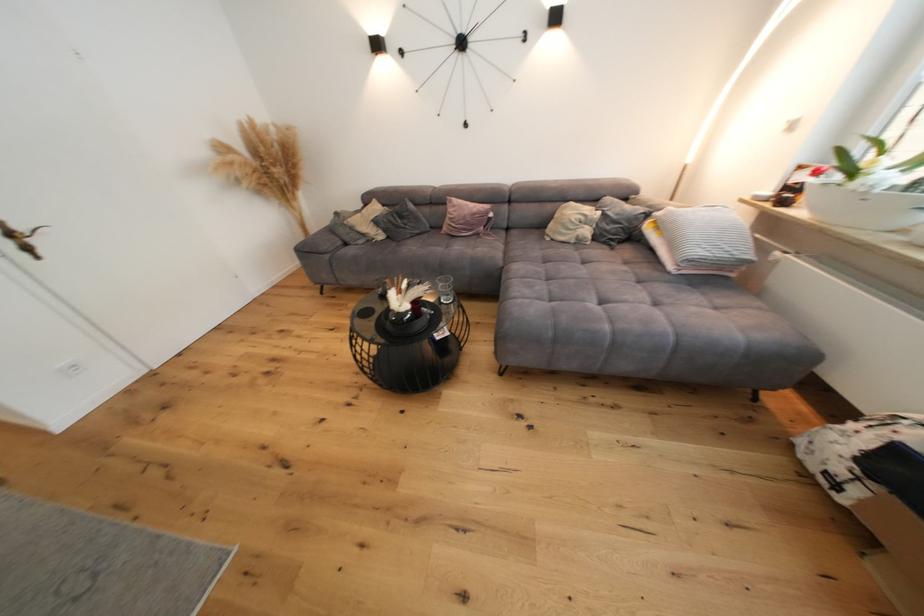
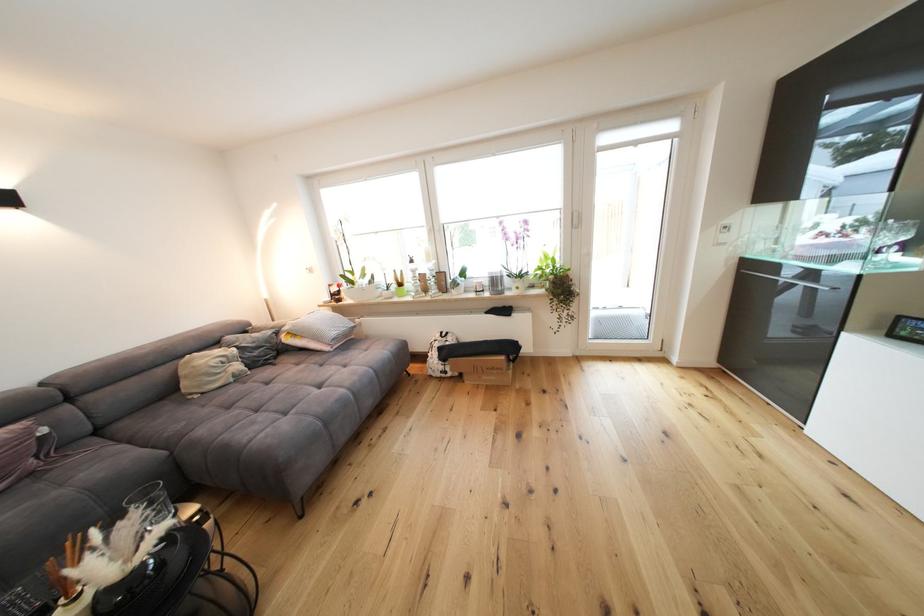
Question: The first image is from the beginning of the video and the second image is from the end. How did the camera likely rotate when shooting the video?

Choices:
 (A) Left
 (B) Right
 (C) Up
 (D) Down

Answer: (B)